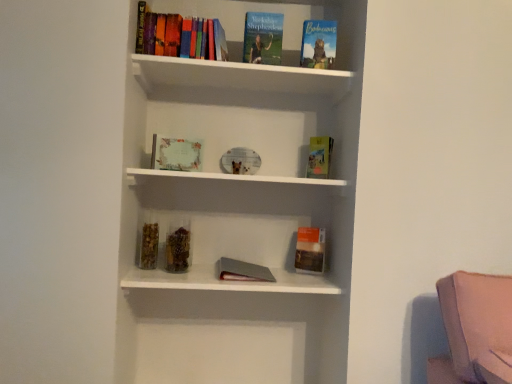
Question: Is matte paper certificate at center, arranged as the 4th book when viewed from the right, facing towards hardcover book at center, which ranks as the 2th paperback book in bottom-to-top order?

Choices:
 (A) yes
 (B) no

Answer: (B)

Question: Does matte paper certificate at center, marked as the 1th book in a left-to-right arrangement, lie behind hardcover book at center, which ranks as the 2th paperback book in bottom-to-top order?

Choices:
 (A) no
 (B) yes

Answer: (A)

Question: From a real-world perspective, is matte paper certificate at center, marked as the 1th book in a left-to-right arrangement, located beneath hardcover book at center, marked as the first paperback book in a top-to-bottom arrangement?

Choices:
 (A) yes
 (B) no

Answer: (A)

Question: Does matte paper certificate at center, arranged as the 4th book when viewed from the right, have a greater width compared to hardcover book at center, which ranks as the 2th paperback book in bottom-to-top order?

Choices:
 (A) no
 (B) yes

Answer: (B)

Question: Can we say matte paper certificate at center, arranged as the 4th book when viewed from the right, lies outside hardcover book at center, marked as the first paperback book in a top-to-bottom arrangement?

Choices:
 (A) yes
 (B) no

Answer: (A)

Question: Is matte paper certificate at center, marked as the 1th book in a left-to-right arrangement, bigger or smaller than hardcover book at upper center, marked as the 2th book in a left-to-right arrangement?

Choices:
 (A) small
 (B) big

Answer: (A)

Question: From a real-world perspective, relative to hardcover book at upper center, which is the third book from right to left, is matte paper certificate at center, marked as the 1th book in a left-to-right arrangement, vertically above or below?

Choices:
 (A) above
 (B) below

Answer: (B)

Question: Is matte paper certificate at center, marked as the 1th book in a left-to-right arrangement, in front of or behind hardcover book at upper center, marked as the 2th book in a left-to-right arrangement, in the image?

Choices:
 (A) behind
 (B) front

Answer: (A)

Question: Would you say matte paper certificate at center, marked as the 1th book in a left-to-right arrangement, is inside or outside hardcover book at upper center, which is the third book from right to left?

Choices:
 (A) outside
 (B) inside

Answer: (A)

Question: In terms of height, does hardcover book at upper center, the third book from the left, look taller or shorter compared to hardcover book at upper right, positioned as the 4th book in left-to-right order?

Choices:
 (A) tall
 (B) short

Answer: (A)

Question: Based on their sizes in the image, would you say hardcover book at upper center, the 2th book viewed from the right, is bigger or smaller than hardcover book at upper right, placed as the 1th book when sorted from right to left?

Choices:
 (A) small
 (B) big

Answer: (B)

Question: From the image's perspective, is hardcover book at upper center, the third book from the left, above or below hardcover book at upper right, placed as the 1th book when sorted from right to left?

Choices:
 (A) above
 (B) below

Answer: (A)

Question: Is hardcover book at upper center, the 2th book viewed from the right, wider or thinner than hardcover book at upper right, placed as the 1th book when sorted from right to left?

Choices:
 (A) thin
 (B) wide

Answer: (B)

Question: In terms of size, does hardcover book at center, marked as the first paperback book in a top-to-bottom arrangement, appear bigger or smaller than hardcover book at upper right, positioned as the 4th book in left-to-right order?

Choices:
 (A) small
 (B) big

Answer: (A)

Question: Is hardcover book at center, which ranks as the 2th paperback book in bottom-to-top order, taller or shorter than hardcover book at upper right, placed as the 1th book when sorted from right to left?

Choices:
 (A) short
 (B) tall

Answer: (A)